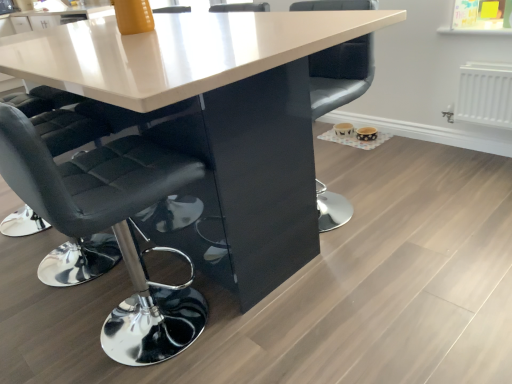
This screenshot has height=384, width=512. What are the coordinates of `vacant area that is situated to the right of black leather chair at center, arranged as the first chair when viewed from the right` in the screenshot? It's located at (401, 192).